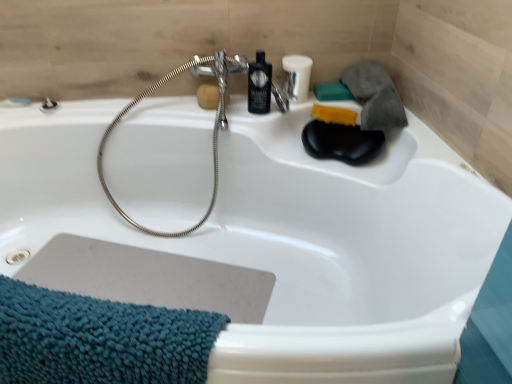
Question: Would you say black plastic mouthwash at upper center is outside yellow sponge at upper right, arranged as the second soap when viewed from the left?

Choices:
 (A) no
 (B) yes

Answer: (B)

Question: Is black plastic mouthwash at upper center at the right side of yellow sponge at upper right, arranged as the second soap when viewed from the left?

Choices:
 (A) no
 (B) yes

Answer: (A)

Question: Is black plastic mouthwash at upper center in front of yellow sponge at upper right, placed as the 2th soap when sorted from right to left?

Choices:
 (A) no
 (B) yes

Answer: (B)

Question: From a real-world perspective, is black plastic mouthwash at upper center physically above yellow sponge at upper right, arranged as the second soap when viewed from the left?

Choices:
 (A) no
 (B) yes

Answer: (B)

Question: Considering the relative sizes of black plastic mouthwash at upper center and yellow sponge at upper right, placed as the 2th soap when sorted from right to left, in the image provided, is black plastic mouthwash at upper center smaller than yellow sponge at upper right, placed as the 2th soap when sorted from right to left,?

Choices:
 (A) yes
 (B) no

Answer: (B)

Question: Is black plastic mouthwash at upper center at the left side of yellow sponge at upper right, placed as the 2th soap when sorted from right to left?

Choices:
 (A) no
 (B) yes

Answer: (B)

Question: Is matte black bottle at upper center taller than teal chenille towel at lower left?

Choices:
 (A) no
 (B) yes

Answer: (A)

Question: Is matte black bottle at upper center completely or partially outside of teal chenille towel at lower left?

Choices:
 (A) no
 (B) yes

Answer: (B)

Question: From the image's perspective, is matte black bottle at upper center below teal chenille towel at lower left?

Choices:
 (A) no
 (B) yes

Answer: (A)

Question: From the image's perspective, is matte black bottle at upper center on teal chenille towel at lower left?

Choices:
 (A) no
 (B) yes

Answer: (B)

Question: Is matte black bottle at upper center further to the viewer compared to teal chenille towel at lower left?

Choices:
 (A) yes
 (B) no

Answer: (A)

Question: Is matte black bottle at upper center placed right next to teal chenille towel at lower left?

Choices:
 (A) yes
 (B) no

Answer: (B)

Question: Is teal matte soap at upper right, which is the third soap in left-to-right order, looking in the opposite direction of brown sponge at upper center, positioned as the first soap in left-to-right order?

Choices:
 (A) no
 (B) yes

Answer: (A)